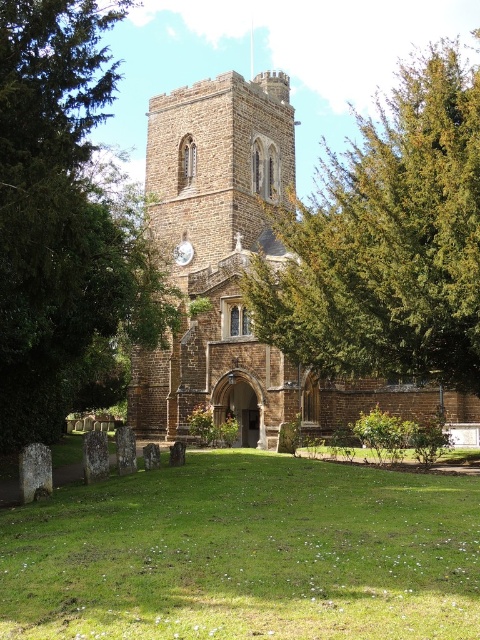
Question: Where is green grass at center located in relation to green leafy tree at center in the image?

Choices:
 (A) left
 (B) right

Answer: (B)

Question: Is green grass at center closer to camera compared to green leafy tree at center?

Choices:
 (A) no
 (B) yes

Answer: (B)

Question: Is green grass at center closer to camera compared to green leafy tree at upper center?

Choices:
 (A) yes
 (B) no

Answer: (A)

Question: Which object appears closest to the camera in this image?

Choices:
 (A) brown stone church at center
 (B) green grass at center

Answer: (B)

Question: Among these points, which one is farthest from the camera?

Choices:
 (A) (458, 237)
 (B) (208, 246)

Answer: (B)

Question: Which point is closer to the camera?

Choices:
 (A) green leafy tree at center
 (B) brown stone church at center
 (C) green leafy tree at upper center
 (D) green grass at center

Answer: (D)